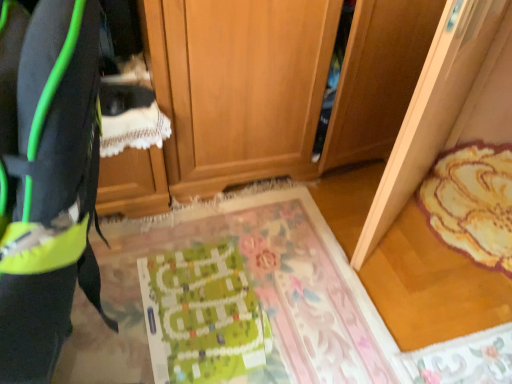
Question: From the image's perspective, is wooden cabinet at center positioned above or below neon green fabric at left?

Choices:
 (A) above
 (B) below

Answer: (A)

Question: Does point (198, 97) appear closer or farther from the camera than point (26, 216)?

Choices:
 (A) closer
 (B) farther

Answer: (B)

Question: Which object is positioned farthest from the wooden cabinet at center?

Choices:
 (A) green fabric mat at center, which is the second mat in right-to-left order
 (B) green paper at center
 (C) floral fabric rug at right, positioned as the first mat in right-to-left order
 (D) neon green fabric at left

Answer: (D)

Question: Estimate the real-world distances between objects in this image. Which object is closer to the green fabric mat at center, which is the second mat in right-to-left order?

Choices:
 (A) neon green fabric at left
 (B) green paper at center
 (C) floral fabric rug at right, which ranks as the 2th mat in left-to-right order
 (D) wooden cabinet at center

Answer: (B)